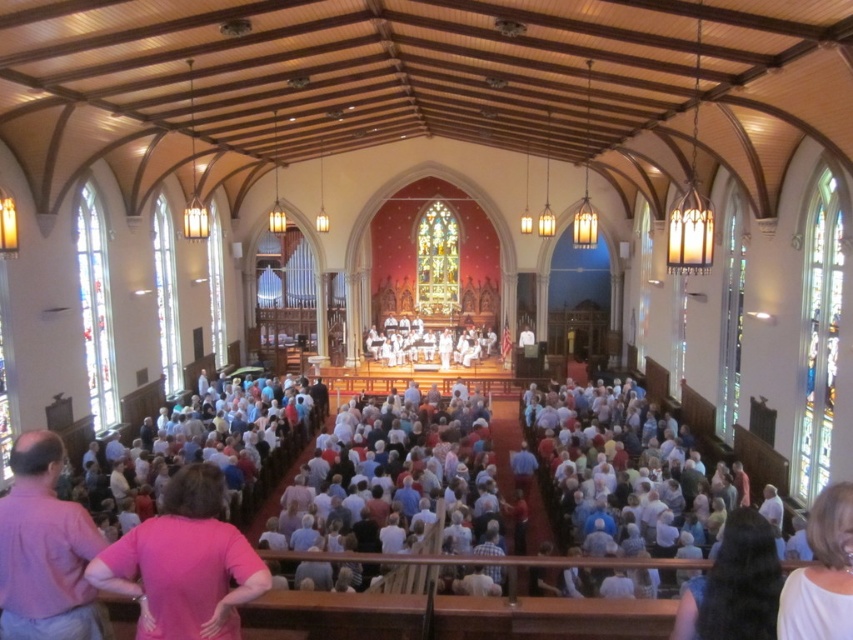
Is dark brown hair at lower right closer to camera compared to white matte shirt at lower right?

No.

Can you confirm if dark brown hair at lower right is smaller than white matte shirt at lower right?

Incorrect, dark brown hair at lower right is not smaller in size than white matte shirt at lower right.

Is point (761, 541) positioned before point (820, 516)?

No, (761, 541) is further to viewer.

Find the location of a particular element. Image resolution: width=853 pixels, height=640 pixels. dark brown hair at lower right is located at coordinates (734, 586).

Which is more to the left, pink fabric shirt at lower left or pink shirt at lower left?

From the viewer's perspective, pink shirt at lower left appears more on the left side.

Does pink fabric shirt at lower left have a greater width compared to pink shirt at lower left?

Correct, the width of pink fabric shirt at lower left exceeds that of pink shirt at lower left.

Does point (189, 596) lie behind point (3, 582)?

That is False.

In order to click on pink fabric shirt at lower left in this screenshot , I will do `click(184, 563)`.

Which is in front, point (125, 557) or point (817, 598)?

Point (817, 598) is more forward.

Is pink fabric shirt at lower left smaller than white matte shirt at lower right?

Incorrect, pink fabric shirt at lower left is not smaller in size than white matte shirt at lower right.

I want to click on pink fabric shirt at lower left, so click(x=184, y=563).